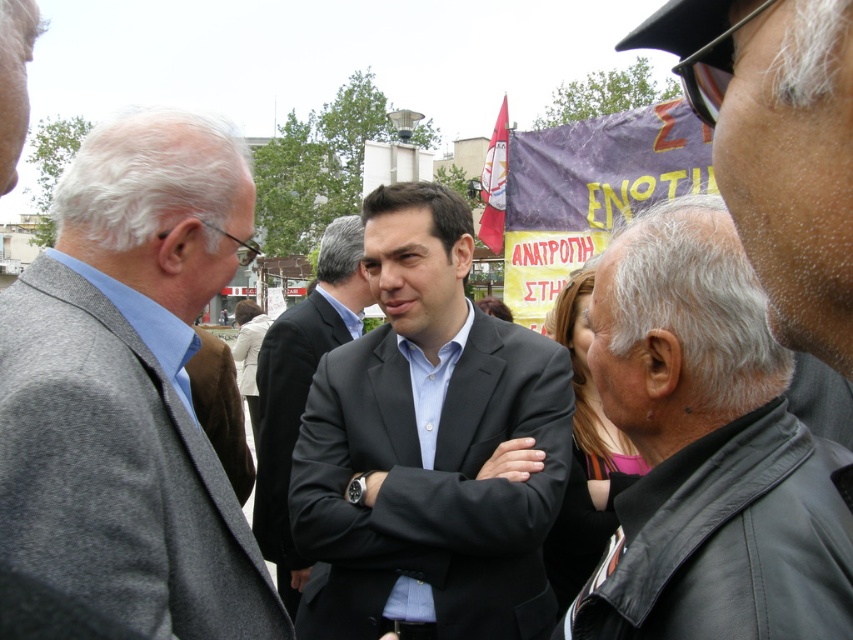
Can you confirm if gray woolen suit at left is taller than dark gray suit at center?

No, gray woolen suit at left is not taller than dark gray suit at center.

Does point (19, 296) come closer to viewer compared to point (360, 275)?

Yes, point (19, 296) is closer to viewer.

Who is more forward, (70, 467) or (328, 252)?

Point (70, 467) is more forward.

Image resolution: width=853 pixels, height=640 pixels. Identify the location of gray woolen suit at left. (131, 387).

Does matte black suit at center have a smaller size compared to black leather jacket at right?

No.

Can you confirm if matte black suit at center is taller than black leather jacket at right?

Yes.

Locate an element on the screen. The height and width of the screenshot is (640, 853). matte black suit at center is located at coordinates (427, 449).

In order to click on matte black suit at center in this screenshot , I will do `click(427, 449)`.

What do you see at coordinates (131, 387) in the screenshot? This screenshot has width=853, height=640. I see `gray woolen suit at left` at bounding box center [131, 387].

Can you confirm if gray woolen suit at left is smaller than black leather jacket at right?

No, gray woolen suit at left is not smaller than black leather jacket at right.

You are a GUI agent. You are given a task and a screenshot of the screen. Output one action in this format:
    pyautogui.click(x=<x>, y=<y>)
    Task: Click on the gray woolen suit at left
    
    Given the screenshot: What is the action you would take?
    pyautogui.click(x=131, y=387)